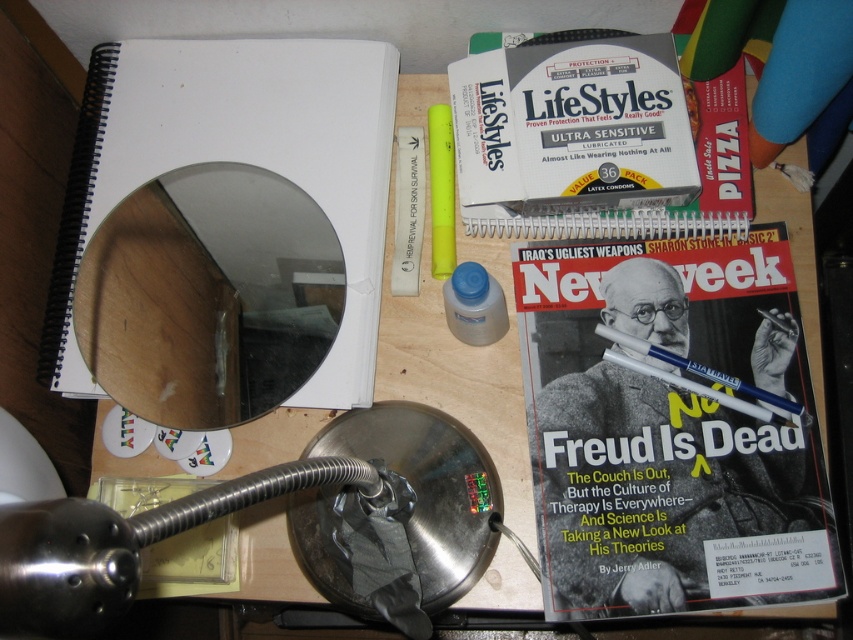
Question: Does white paper notebook at upper left appear under matte paper magazine at center right?

Choices:
 (A) yes
 (B) no

Answer: (B)

Question: Is white paper notebook at upper left smaller than yellow matte highlighter at center?

Choices:
 (A) yes
 (B) no

Answer: (B)

Question: Which is farther from the blue plastic pen at center?

Choices:
 (A) white paper notebook at upper left
 (B) yellow matte highlighter at center
 (C) matte paper magazine at center right
 (D) metallic silver magnifying glass at lower center

Answer: (A)

Question: Where is white paper notebook at upper left located in relation to yellow matte highlighter at center in the image?

Choices:
 (A) above
 (B) below

Answer: (B)

Question: Among these points, which one is farthest from the camera?

Choices:
 (A) pyautogui.click(x=656, y=356)
 (B) pyautogui.click(x=531, y=257)
 (C) pyautogui.click(x=432, y=212)

Answer: (C)

Question: Which object is positioned closest to the white paper notebook at upper left?

Choices:
 (A) yellow matte highlighter at center
 (B) metallic silver magnifying glass at lower center
 (C) matte paper magazine at center right
 (D) blue plastic pen at center

Answer: (A)